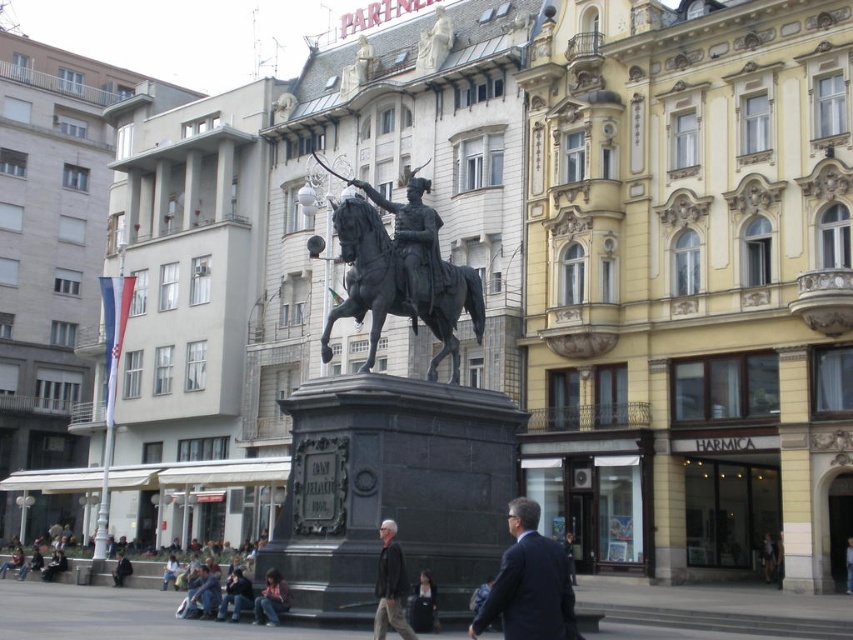
Can you confirm if polished bronze horse at center is positioned to the left of dark gray jacket at center?

Correct, you'll find polished bronze horse at center to the left of dark gray jacket at center.

Who is more forward, (428, 300) or (381, 593)?

Point (381, 593) is in front.

Find the location of a particular element. polished bronze horse at center is located at coordinates coord(399,284).

Find the location of `dark gray suit at center`. dark gray suit at center is located at coordinates (529, 582).

Does point (479, 609) lie in front of point (259, 605)?

Yes, point (479, 609) is closer to viewer.

The width and height of the screenshot is (853, 640). Find the location of `dark gray suit at center`. dark gray suit at center is located at coordinates (529, 582).

Is point (433, 248) positioned behind point (267, 582)?

Yes, point (433, 248) is behind point (267, 582).

Which is above, polished bronze horse at center or denim jacket at lower center?

Positioned higher is polished bronze horse at center.

Is point (454, 308) positioned in front of point (260, 605)?

No, (454, 308) is further to viewer.

Identify the location of polished bronze horse at center. The width and height of the screenshot is (853, 640). (399, 284).